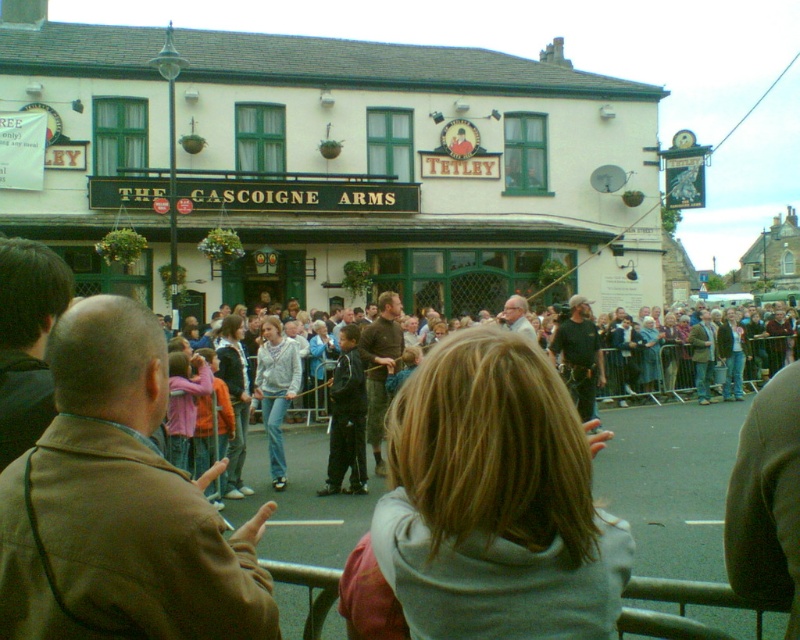
You are a photographer trying to capture a candid shot of the light brown hair at center and the light gray hoodie at center. To ensure both subjects are in frame, should you adjust your camera to focus on the left or the right side of the current view?

You should focus on the left side of the current view because the light brown hair at center is to the left of the light gray hoodie at center. This positioning ensures both subjects are captured within the frame.

You are standing at the entrance of The Gascoigne Arms pub and want to take a photo of the person with light brown hair at center. Where should you aim your camera to capture them?

You should aim your camera at point 0.791 on the horizontal axis and 0.611 on the vertical axis to capture the person with light brown hair at center.